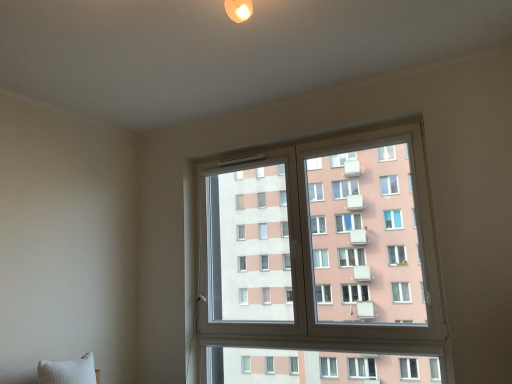
What do you see at coordinates (320, 263) in the screenshot? Image resolution: width=512 pixels, height=384 pixels. I see `transparent glass window at center` at bounding box center [320, 263].

Where is `transparent glass window at center`? This screenshot has width=512, height=384. transparent glass window at center is located at coordinates (320, 263).

Based on the photo, what is the approximate width of transparent glass window at center?

It is 3.83 inches.

What do you see at coordinates (68, 371) in the screenshot? Image resolution: width=512 pixels, height=384 pixels. I see `white textured pillow at lower left` at bounding box center [68, 371].

Measure the distance between point (x=71, y=375) and camera.

The depth of point (x=71, y=375) is 2.40 meters.

Where is `white textured pillow at lower left`? This screenshot has height=384, width=512. white textured pillow at lower left is located at coordinates (68, 371).

Identify the location of transparent glass window at center. Image resolution: width=512 pixels, height=384 pixels. (320, 263).

Does transparent glass window at center appear on the left side of white textured pillow at lower left?

In fact, transparent glass window at center is to the right of white textured pillow at lower left.

Does transparent glass window at center come behind white textured pillow at lower left?

Yes, it is.

Is point (319, 350) positioned in front of point (76, 364)?

That is False.

From the image's perspective, is transparent glass window at center above white textured pillow at lower left?

Indeed, from the image's perspective, transparent glass window at center is shown above white textured pillow at lower left.

From a real-world perspective, between transparent glass window at center and white textured pillow at lower left, who is vertically higher?

In real-world perspective, transparent glass window at center is above.

Considering the sizes of transparent glass window at center and white textured pillow at lower left in the image, is transparent glass window at center wider or thinner than white textured pillow at lower left?

Considering their sizes, transparent glass window at center looks slimmer than white textured pillow at lower left.

Is transparent glass window at center taller than white textured pillow at lower left?

Correct, transparent glass window at center is much taller as white textured pillow at lower left.

Does transparent glass window at center have a smaller size compared to white textured pillow at lower left?

Incorrect, transparent glass window at center is not smaller in size than white textured pillow at lower left.

Is transparent glass window at center not within white textured pillow at lower left?

Indeed, transparent glass window at center is completely outside white textured pillow at lower left.

Is transparent glass window at center positioned far away from white textured pillow at lower left?

Yes.

Is transparent glass window at center looking in the opposite direction of white textured pillow at lower left?

No, white textured pillow at lower left is not at the back of transparent glass window at center.

How different are the orientations of transparent glass window at center and white textured pillow at lower left in degrees?

89.3 degrees separate the facing orientations of transparent glass window at center and white textured pillow at lower left.

Locate an element on the screen. window to the right of white textured pillow at lower left is located at coordinates (320, 263).

Between white textured pillow at lower left and transparent glass window at center, which one appears on the left side from the viewer's perspective?

Positioned to the left is white textured pillow at lower left.

Is white textured pillow at lower left in front of or behind transparent glass window at center in the image?

Clearly, white textured pillow at lower left is in front of transparent glass window at center.

Considering the positions of points (58, 381) and (340, 182), is point (58, 381) closer to camera compared to point (340, 182)?

That is True.

From the image's perspective, would you say white textured pillow at lower left is positioned over transparent glass window at center?

No, from the image's perspective, white textured pillow at lower left is not over transparent glass window at center.

From a real-world perspective, is white textured pillow at lower left over transparent glass window at center?

No, from a real-world perspective, white textured pillow at lower left is not above transparent glass window at center.

Is white textured pillow at lower left wider or thinner than transparent glass window at center?

white textured pillow at lower left is wider than transparent glass window at center.

Can you confirm if white textured pillow at lower left is taller than transparent glass window at center?

No.

Based on the photo, considering the relative sizes of white textured pillow at lower left and transparent glass window at center in the image provided, is white textured pillow at lower left bigger than transparent glass window at center?

Actually, white textured pillow at lower left might be smaller than transparent glass window at center.

Is white textured pillow at lower left positioned beyond the bounds of transparent glass window at center?

Indeed, white textured pillow at lower left is completely outside transparent glass window at center.

In the scene shown: Is white textured pillow at lower left next to transparent glass window at center?

No, white textured pillow at lower left is not touching transparent glass window at center.

Is white textured pillow at lower left oriented towards transparent glass window at center?

No, white textured pillow at lower left is not turned towards transparent glass window at center.

Measure the distance between white textured pillow at lower left and transparent glass window at center.

white textured pillow at lower left is 1.47 meters from transparent glass window at center.

The width and height of the screenshot is (512, 384). Find the location of `window on the right of white textured pillow at lower left`. window on the right of white textured pillow at lower left is located at coordinates pos(320,263).

The width and height of the screenshot is (512, 384). I want to click on window that is above the white textured pillow at lower left (from a real-world perspective), so click(x=320, y=263).

Locate an element on the screen. The image size is (512, 384). pillow below the transparent glass window at center (from the image's perspective) is located at coordinates (68, 371).